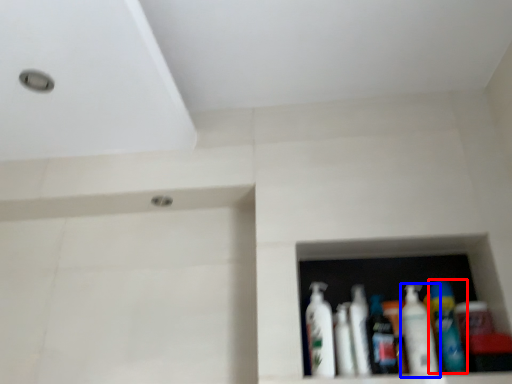
Question: Which point is closer to the camera, bottle (highlighted by a red box) or bottle (highlighted by a blue box)?

Choices:
 (A) bottle
 (B) bottle

Answer: (A)